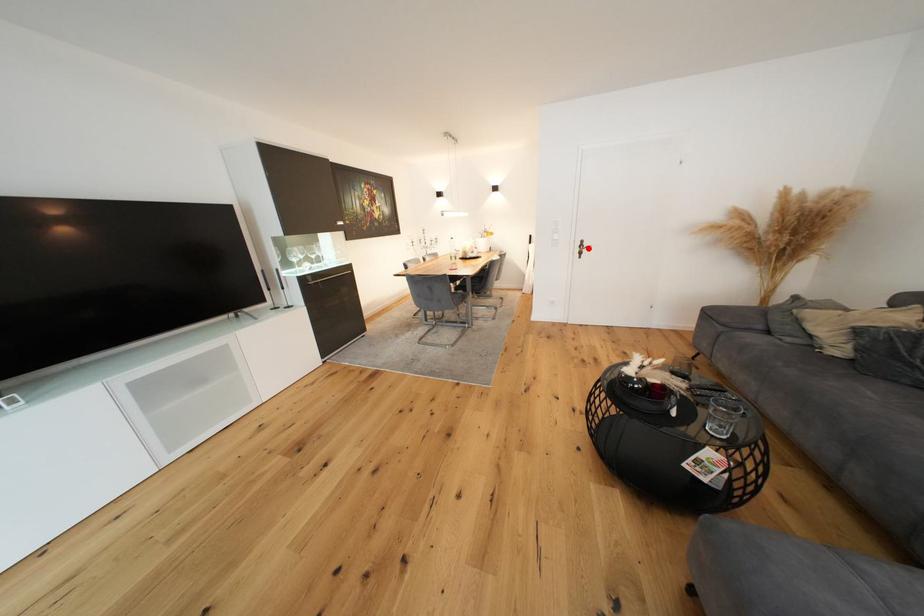
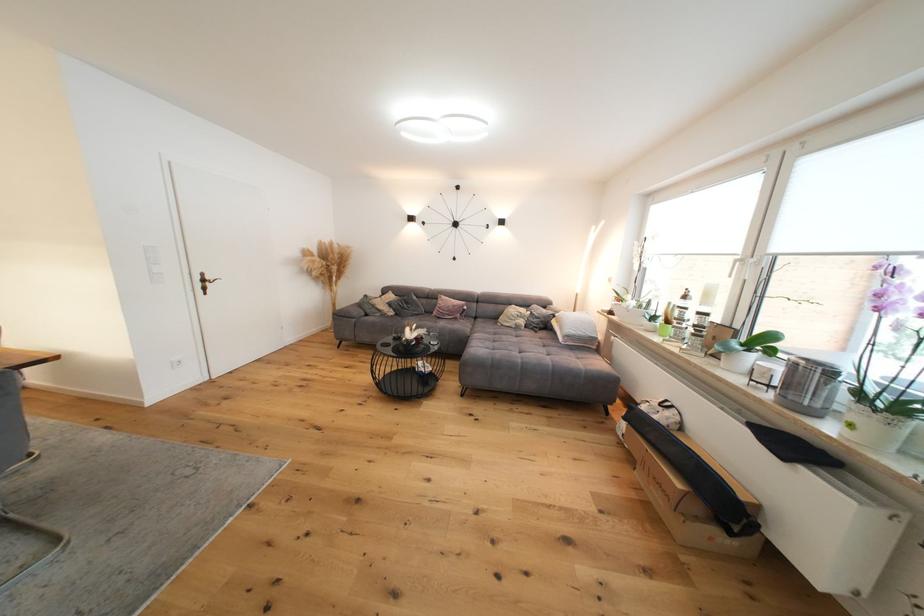
Question: A red point is marked in image1. In image2, is the corresponding 3D point closer to the camera or farther? Reply with the corresponding letter.

Choices:
 (A) The corresponding 3D point is closer.
 (B) The corresponding 3D point is farther.

Answer: (B)